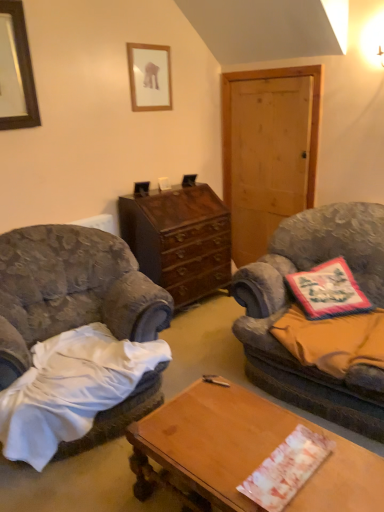
Identify the location of vacant space positioned to the left of white paper at center, the 1th sheet viewed from the front. This screenshot has width=384, height=512. (216, 456).